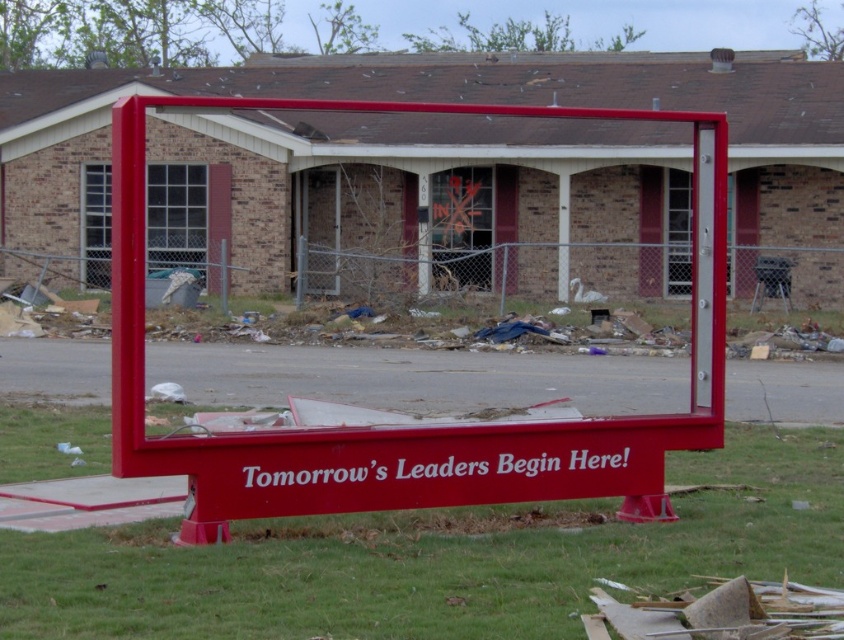
Looking at the scene in front of the brick building, where is the green grass at lower center located relative to the red matte sign at center?

The green grass at lower center is located below the red matte sign at center.

You are a landscape architect inspecting the site. You notice the green grass at lower center and the red matte sign at center. Which area requires more attention for immediate repair based on their sizes?

The red matte sign at center requires more attention for immediate repair because it is larger than the green grass at lower center.

You are standing at the point marked as point (x=437, y=560). What is the color of the ground beneath your feet?

The point (x=437, y=560) is on green grass at lower center, so the ground beneath your feet is green.